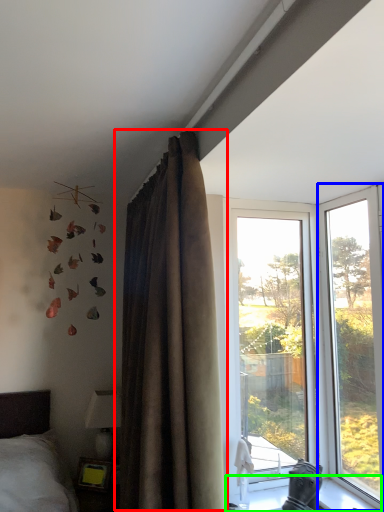
Question: Estimate the real-world distances between objects in this image. Which object is closer to curtain (highlighted by a red box), window (highlighted by a blue box) or window sill (highlighted by a green box)?

Choices:
 (A) window
 (B) window sill

Answer: (B)